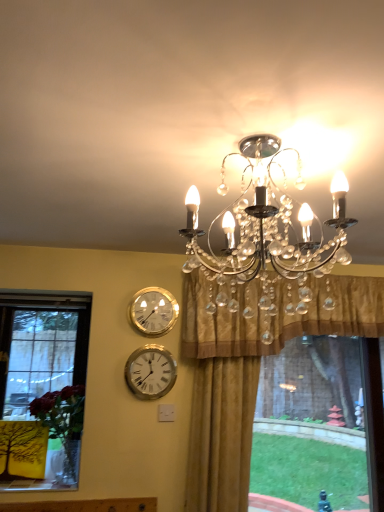
Question: Could you tell me if gold metallic wall clock at upper center, which is the 2th wall clock in bottom-to-top order, is facing gold satin curtain at upper center?

Choices:
 (A) no
 (B) yes

Answer: (A)

Question: Are gold metallic wall clock at upper center, which is the first wall clock in top-to-bottom order, and gold satin curtain at upper center far apart?

Choices:
 (A) yes
 (B) no

Answer: (B)

Question: Is gold metallic wall clock at upper center, which is the 2th wall clock in bottom-to-top order, bigger than gold satin curtain at upper center?

Choices:
 (A) no
 (B) yes

Answer: (A)

Question: From a real-world perspective, is gold metallic wall clock at upper center, which is the 2th wall clock in bottom-to-top order, beneath gold satin curtain at upper center?

Choices:
 (A) no
 (B) yes

Answer: (B)

Question: From the image's perspective, does gold metallic wall clock at upper center, which is the first wall clock in top-to-bottom order, appear higher than gold satin curtain at upper center?

Choices:
 (A) yes
 (B) no

Answer: (A)

Question: Is gold satin curtain at upper center bigger or smaller than white metallic clock at center, marked as the second wall clock in a top-to-bottom arrangement?

Choices:
 (A) small
 (B) big

Answer: (B)

Question: Relative to white metallic clock at center, marked as the second wall clock in a top-to-bottom arrangement, is gold satin curtain at upper center in front or behind?

Choices:
 (A) behind
 (B) front

Answer: (B)

Question: Is gold satin curtain at upper center situated inside white metallic clock at center, marked as the 1th wall clock in a bottom-to-top arrangement, or outside?

Choices:
 (A) inside
 (B) outside

Answer: (B)

Question: Considering the positions of point (375, 300) and point (137, 386), is point (375, 300) closer or farther from the camera than point (137, 386)?

Choices:
 (A) closer
 (B) farther

Answer: (B)

Question: Is clear crystal chandelier at upper center bigger or smaller than white metallic clock at center, marked as the second wall clock in a top-to-bottom arrangement?

Choices:
 (A) small
 (B) big

Answer: (B)

Question: Is clear crystal chandelier at upper center wider or thinner than white metallic clock at center, marked as the second wall clock in a top-to-bottom arrangement?

Choices:
 (A) thin
 (B) wide

Answer: (B)

Question: Is point (279, 248) positioned closer to the camera than point (173, 382)?

Choices:
 (A) farther
 (B) closer

Answer: (B)

Question: Relative to white metallic clock at center, marked as the 1th wall clock in a bottom-to-top arrangement, is clear crystal chandelier at upper center in front or behind?

Choices:
 (A) front
 (B) behind

Answer: (A)

Question: Is point (215, 334) positioned closer to the camera than point (145, 325)?

Choices:
 (A) closer
 (B) farther

Answer: (A)

Question: Visually, is gold satin curtain at upper center positioned to the left or to the right of gold metallic wall clock at upper center, which is the first wall clock in top-to-bottom order?

Choices:
 (A) right
 (B) left

Answer: (A)